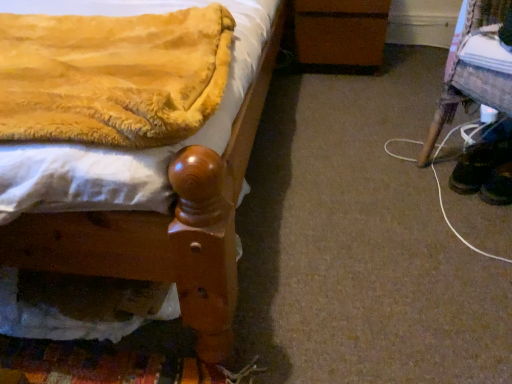
At what (x,y) coordinates should I click in order to perform the action: click on free area in between brown wooden changing table at center and black leather shoes at lower right, acting as the 2th footwear starting from the right. Please return your answer as a coordinate pair (x, y). This screenshot has height=384, width=512. Looking at the image, I should click on (379, 102).